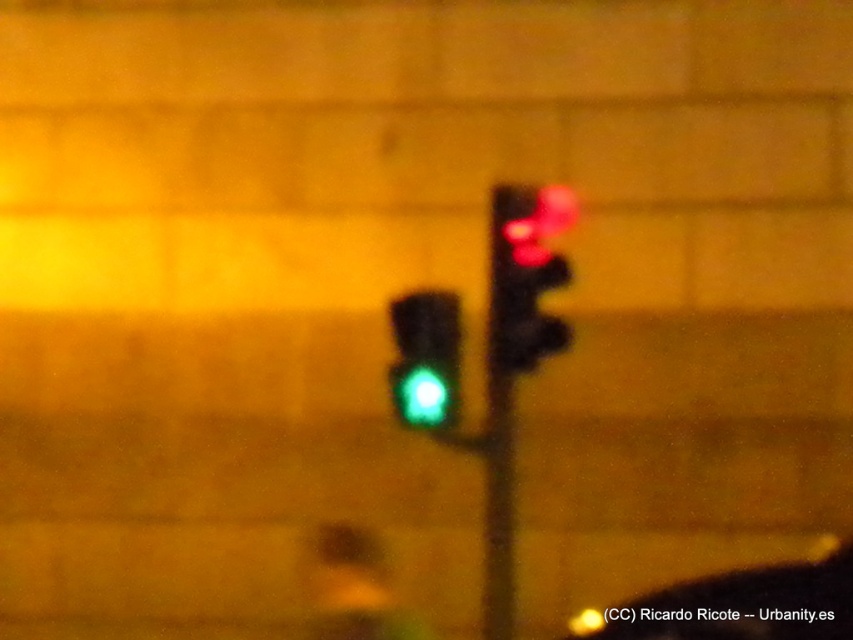
In the scene shown: Who is shorter, matte black traffic light at upper right or green glass traffic light at center?

green glass traffic light at center

Does matte black traffic light at upper right come in front of green glass traffic light at center?

Yes, it is in front of green glass traffic light at center.

Does point (498, 196) come in front of point (447, 412)?

Yes, it is.

Find the location of a particular element. The image size is (853, 640). matte black traffic light at upper right is located at coordinates (526, 273).